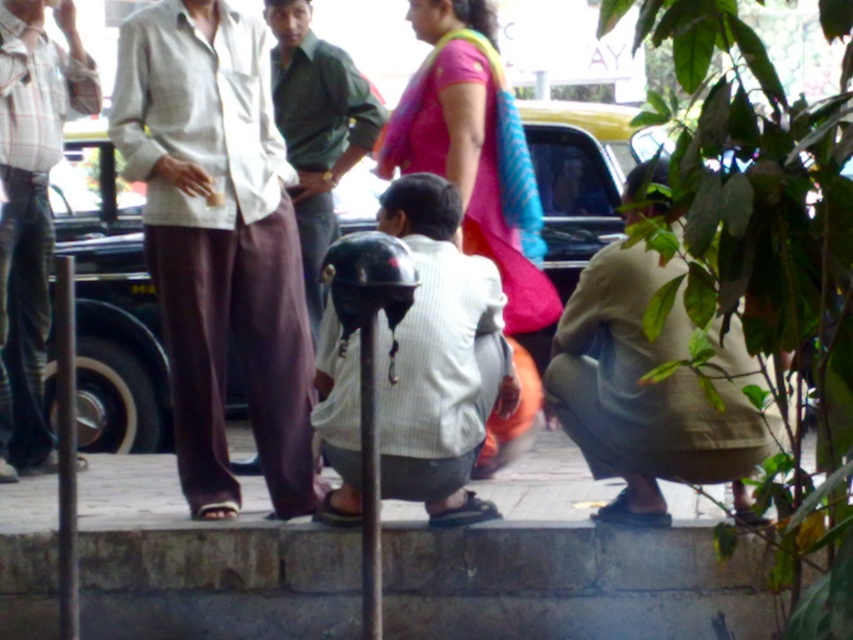
The height and width of the screenshot is (640, 853). What are the coordinates of `light brown cotton pants at center` in the screenshot? It's located at (218, 243).

In the scene shown: Between light brown cotton pants at center and plaid cotton shirt at left, which one is positioned lower?

light brown cotton pants at center is lower down.

What are the coordinates of `light brown cotton pants at center` in the screenshot? It's located at (218, 243).

Is point (439, 576) farther from camera compared to point (196, 179)?

That is False.

Does gray stone curb at lower center have a lesser height compared to light brown cotton pants at center?

Correct, gray stone curb at lower center is not as tall as light brown cotton pants at center.

Describe the element at coordinates (570, 582) in the screenshot. The height and width of the screenshot is (640, 853). I see `gray stone curb at lower center` at that location.

You are a GUI agent. You are given a task and a screenshot of the screen. Output one action in this format:
    pyautogui.click(x=<x>, y=<y>)
    Task: Click on the gray stone curb at lower center
    Image resolution: width=853 pixels, height=640 pixels.
    Given the screenshot: What is the action you would take?
    pyautogui.click(x=570, y=582)

Is light brown cotton pants at center positioned behind green fabric shirt at center?

No, it is in front of green fabric shirt at center.

Is light brown cotton pants at center to the right of green fabric shirt at center from the viewer's perspective?

In fact, light brown cotton pants at center is to the left of green fabric shirt at center.

At what (x,y) coordinates should I click in order to perform the action: click on light brown cotton pants at center. Please return your answer as a coordinate pair (x, y). The width and height of the screenshot is (853, 640). Looking at the image, I should click on (218, 243).